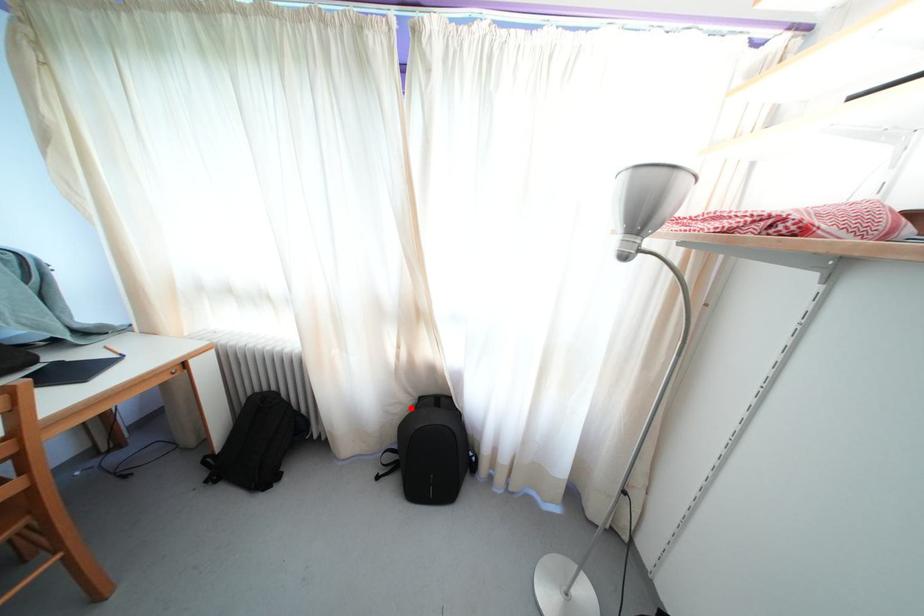
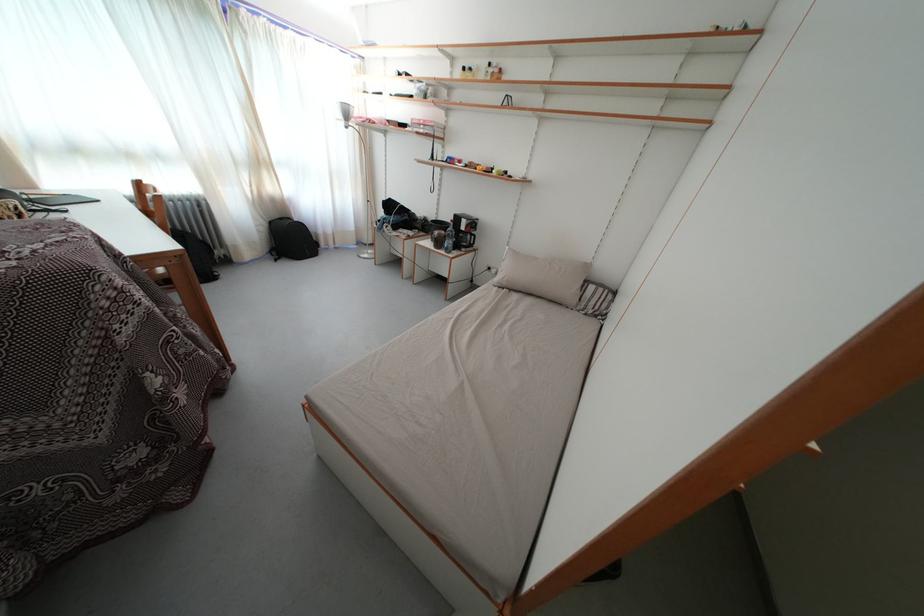
Where in the second image is the point corresponding to the highlighted location from the first image?

(272, 230)